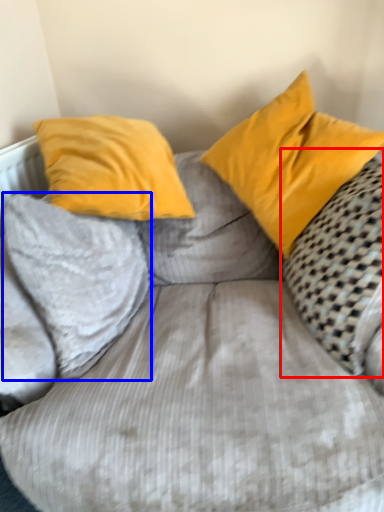
Question: Which point is further to the camera, pillow (highlighted by a red box) or pillow (highlighted by a blue box)?

Choices:
 (A) pillow
 (B) pillow

Answer: (B)